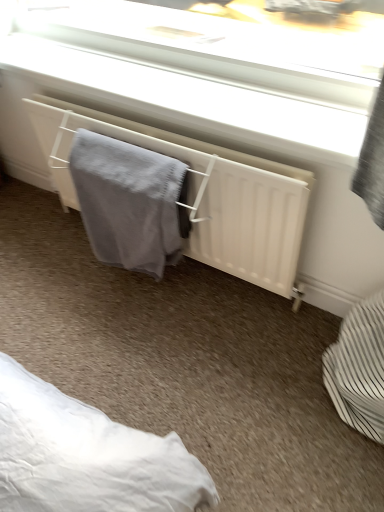
Question: Is white matte radiator at center situated inside white striped basket at lower right or outside?

Choices:
 (A) outside
 (B) inside

Answer: (A)

Question: Considering the positions of white matte radiator at center and white striped basket at lower right in the image, is white matte radiator at center wider or thinner than white striped basket at lower right?

Choices:
 (A) wide
 (B) thin

Answer: (B)

Question: Which object is positioned farthest from the white striped basket at lower right?

Choices:
 (A) white matte radiator at center
 (B) gray knitted towel at center

Answer: (B)

Question: Estimate the real-world distances between objects in this image. Which object is closer to the white striped basket at lower right?

Choices:
 (A) gray knitted towel at center
 (B) white matte radiator at center

Answer: (B)